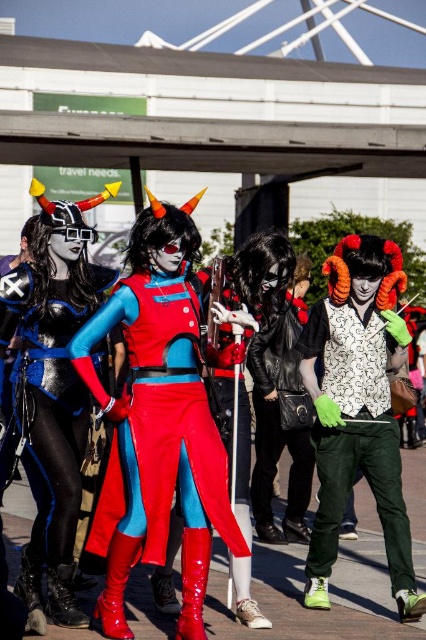
Which of these two, matte black vest at center or metallic blue bodysuit at center, stands taller?

matte black vest at center

Can you confirm if matte black vest at center is smaller than metallic blue bodysuit at center?

No, matte black vest at center is not smaller than metallic blue bodysuit at center.

The width and height of the screenshot is (426, 640). In order to click on matte black vest at center in this screenshot , I will do coord(357,410).

Between shiny red boots at center and metallic blue bodysuit at center, which one is positioned lower?

Positioned lower is shiny red boots at center.

Does point (95, 548) come farther from viewer compared to point (71, 556)?

Yes, it is behind point (71, 556).

At what (x,y) coordinates should I click in order to perform the action: click on shiny red boots at center. Please return your answer as a coordinate pair (x, y). The height and width of the screenshot is (640, 426). Looking at the image, I should click on (178, 456).

Which is below, matte black vest at center or shiny red boots at center?

matte black vest at center

Between matte black vest at center and shiny red boots at center, which one has more height?

With more height is matte black vest at center.

The height and width of the screenshot is (640, 426). Identify the location of matte black vest at center. (357, 410).

At what (x,y) coordinates should I click in order to perform the action: click on matte black vest at center. Please return your answer as a coordinate pair (x, y). Looking at the image, I should click on (357, 410).